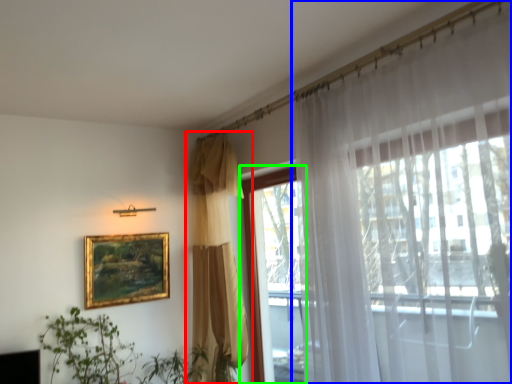
Question: Which is nearer to the curtain (highlighted by a red box)? curtain (highlighted by a blue box) or window (highlighted by a green box).

Choices:
 (A) curtain
 (B) window

Answer: (B)